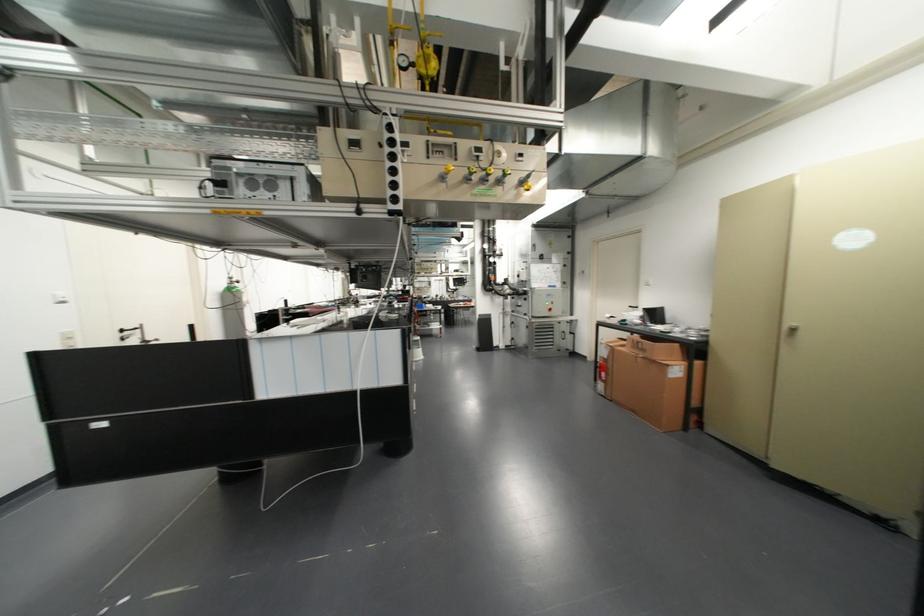
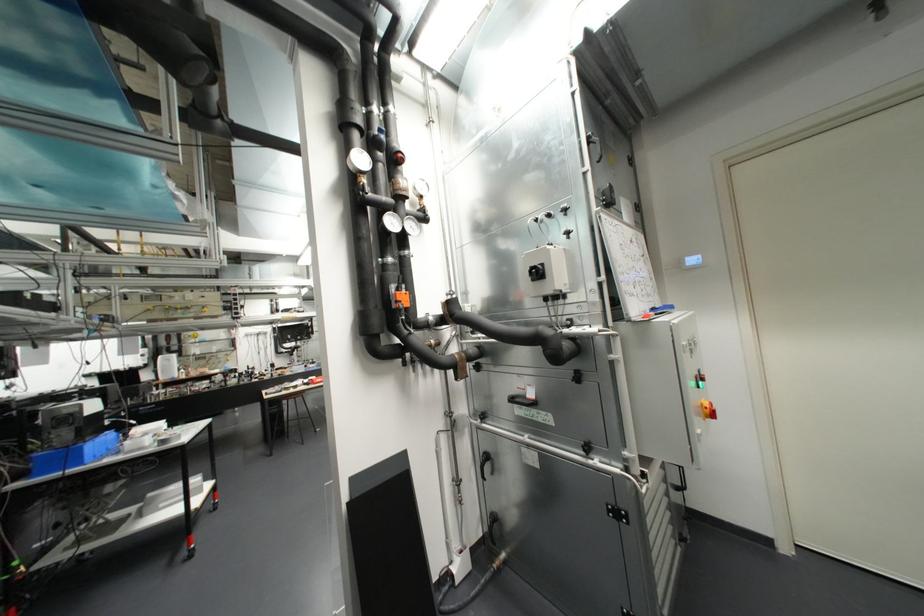
Find the pixel in the second image that matches the point at 420,306 in the first image.

(71, 459)